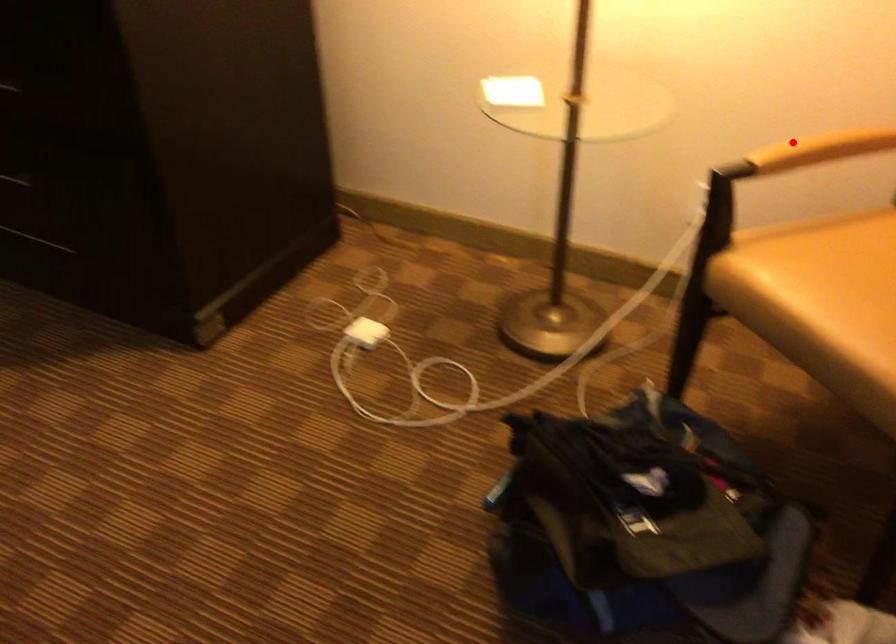
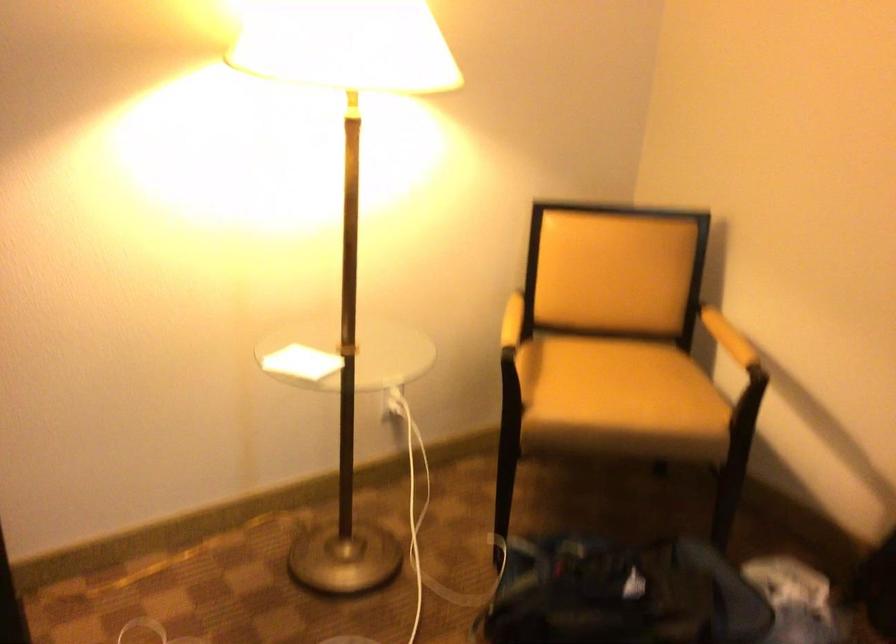
Locate, in the second image, the point that corresponds to the highlighted location in the first image.

(512, 321)